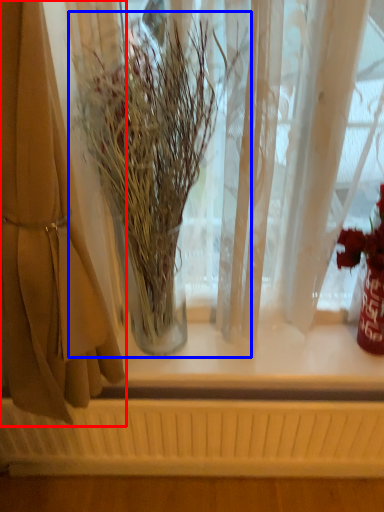
Question: Which object is closer to the camera taking this photo, curtain (highlighted by a red box) or houseplant (highlighted by a blue box)?

Choices:
 (A) curtain
 (B) houseplant

Answer: (A)